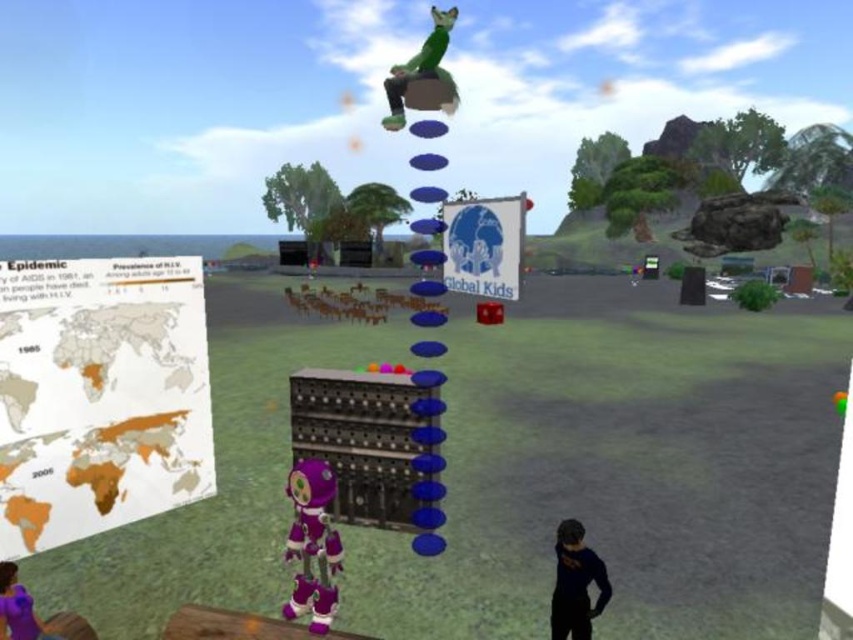
You are navigating a virtual environment with a bright blue sky. You see a dark blue fabric shirt at lower right. Can you determine its exact location using the coordinate system where the bottom left corner is the origin point?

The dark blue fabric shirt at lower right is located at point (575, 582).